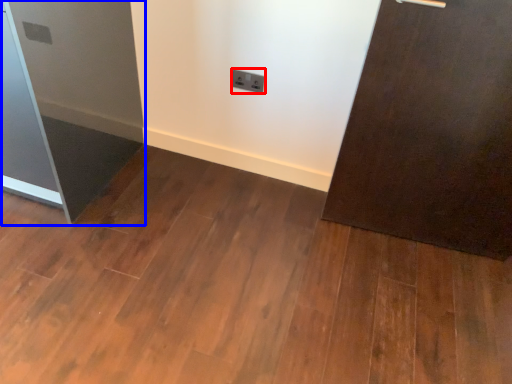
Question: Among these objects, which one is farthest to the camera, electric outlet (highlighted by a red box) or fridge (highlighted by a blue box)?

Choices:
 (A) electric outlet
 (B) fridge

Answer: (A)